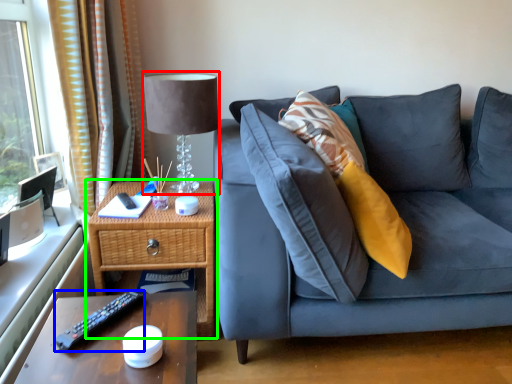
Question: Which object is the closest to the table lamp (highlighted by a red box)? Choose among these: remote (highlighted by a blue box) or nightstand (highlighted by a green box).

Choices:
 (A) remote
 (B) nightstand

Answer: (B)